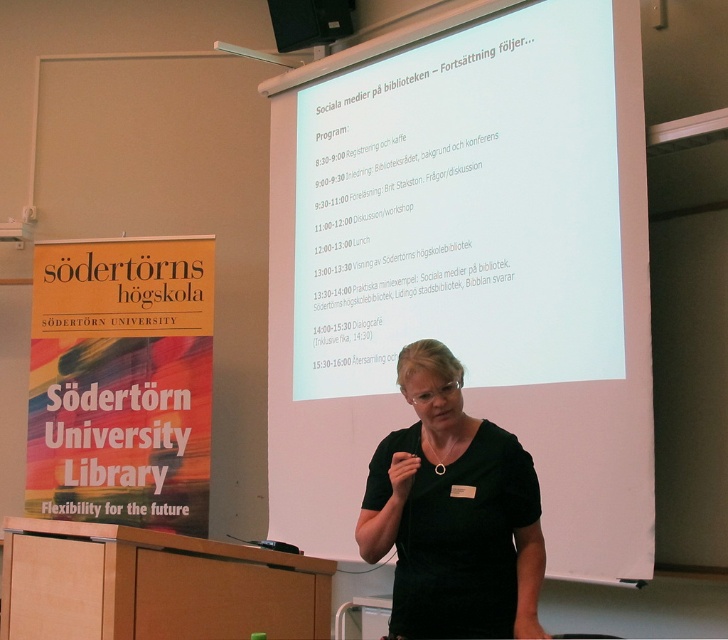
Question: Which point appears farthest from the camera in this image?

Choices:
 (A) (403, 611)
 (B) (397, 29)

Answer: (B)

Question: Is white matte projection screen at center thinner than black matte dress at center?

Choices:
 (A) yes
 (B) no

Answer: (B)

Question: Which point appears farthest from the camera in this image?

Choices:
 (A) (496, 476)
 (B) (633, 536)

Answer: (B)

Question: Where is white matte projection screen at center located in relation to black matte dress at center in the image?

Choices:
 (A) left
 (B) right

Answer: (B)

Question: Which point is closer to the camera?

Choices:
 (A) black matte dress at center
 (B) white matte projection screen at center

Answer: (A)

Question: Is white matte projection screen at center smaller than black matte dress at center?

Choices:
 (A) yes
 (B) no

Answer: (B)